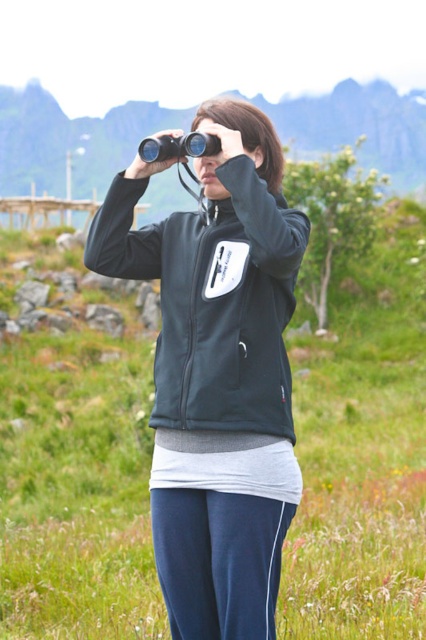
You are a photographer trying to capture the person in the matte black sweatshirt at center. The camera you are using has a focus point at coordinates 0.469, 0.500. Will the person be in focus?

The matte black sweatshirt at center is located at point (213, 300), so yes, the person will be in focus since the camera focus point matches their location.